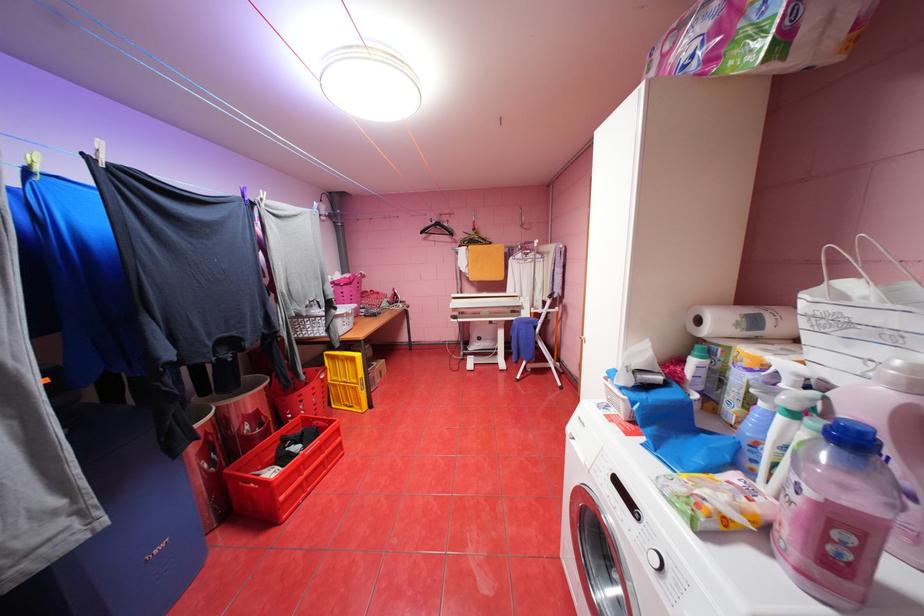
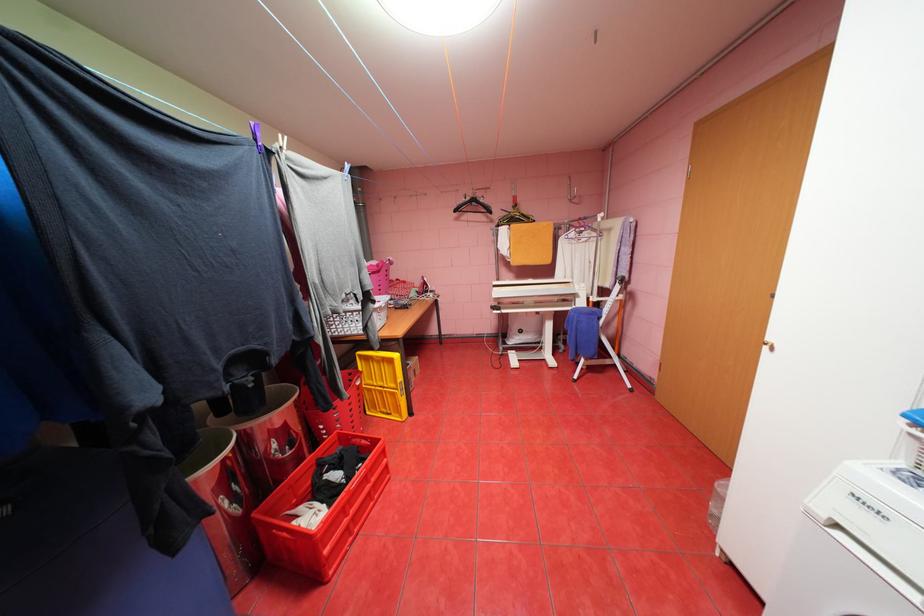
Locate, in the second image, the point that corresponds to the point at 532,362 in the first image.

(591, 360)